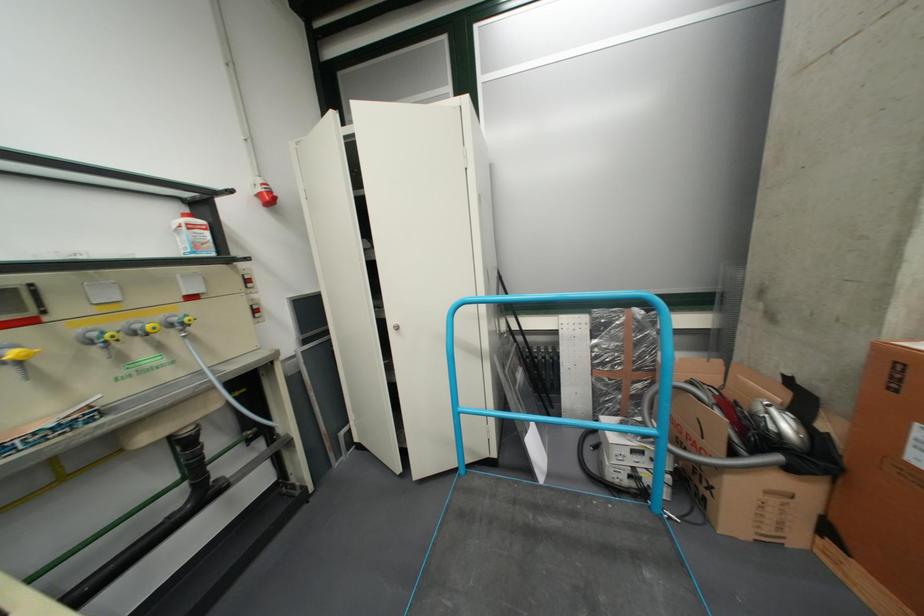
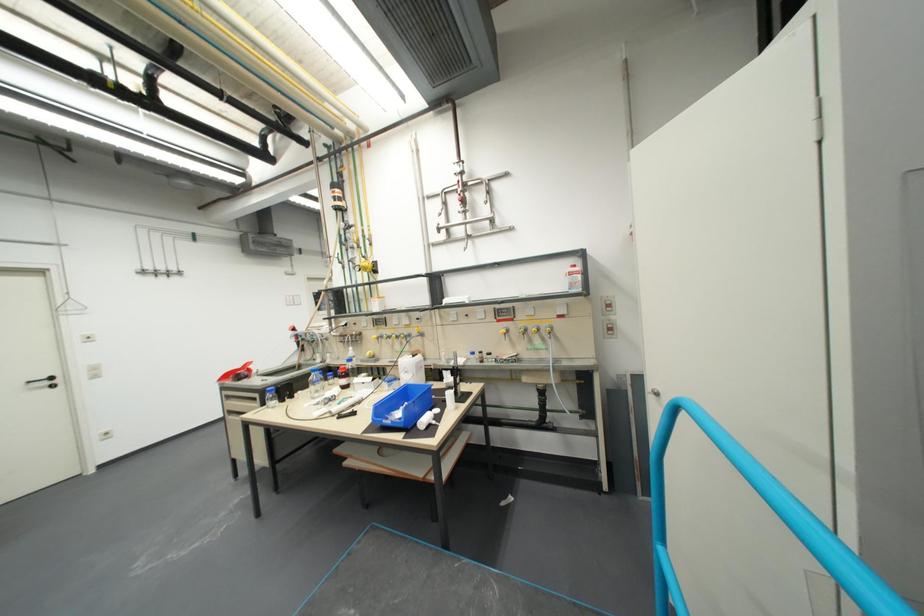
Question: The camera is either moving clockwise (left) or counter-clockwise (right) around the object. The first image is from the beginning of the video and the second image is from the end. Is the camera moving left or right when shooting the video?

Choices:
 (A) Left
 (B) Right

Answer: (B)